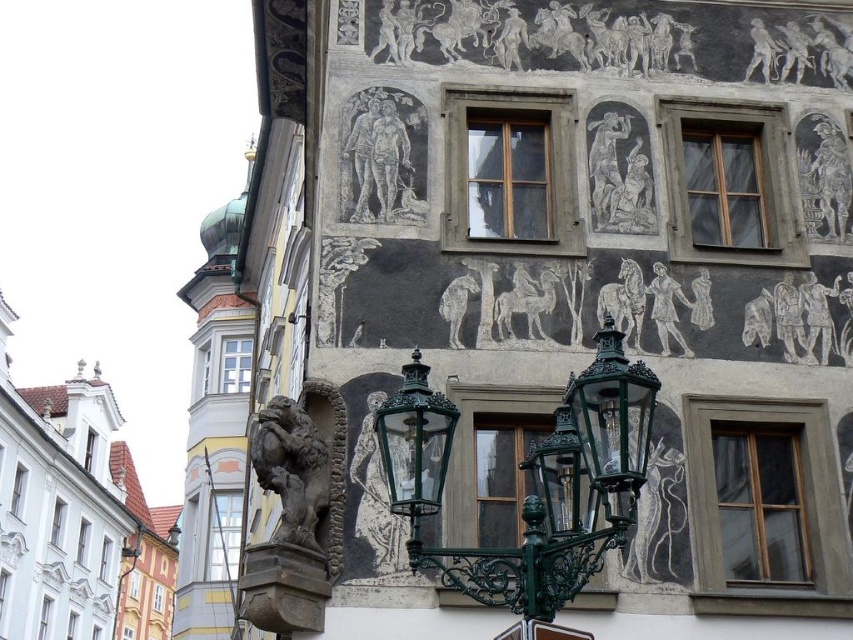
In the scene shown: Is gray stone relief of couple at center positioned at the back of gray stone statue at upper right?

Yes.

Does point (380, 164) come behind point (704, 314)?

That is True.

Who is more forward, (409, 202) or (701, 301)?

Point (701, 301) is more forward.

This screenshot has width=853, height=640. I want to click on gray stone relief of couple at center, so click(x=383, y=157).

Does dark stone lion at lower left have a greater height compared to gray stone statue at upper right?

Yes.

Is point (308, 534) in front of point (706, 305)?

That is True.

Does point (285, 502) come farther from viewer compared to point (695, 298)?

That is False.

Image resolution: width=853 pixels, height=640 pixels. I want to click on dark stone lion at lower left, so click(x=292, y=468).

The width and height of the screenshot is (853, 640). What do you see at coordinates (532, 480) in the screenshot?
I see `green wrought iron streetlight at center` at bounding box center [532, 480].

In the scene shown: Can you confirm if green wrought iron streetlight at center is taller than black stone relief at upper right?

Yes.

Where is `green wrought iron streetlight at center`? The image size is (853, 640). green wrought iron streetlight at center is located at coordinates (532, 480).

Image resolution: width=853 pixels, height=640 pixels. What are the coordinates of `green wrought iron streetlight at center` in the screenshot? It's located at (532, 480).